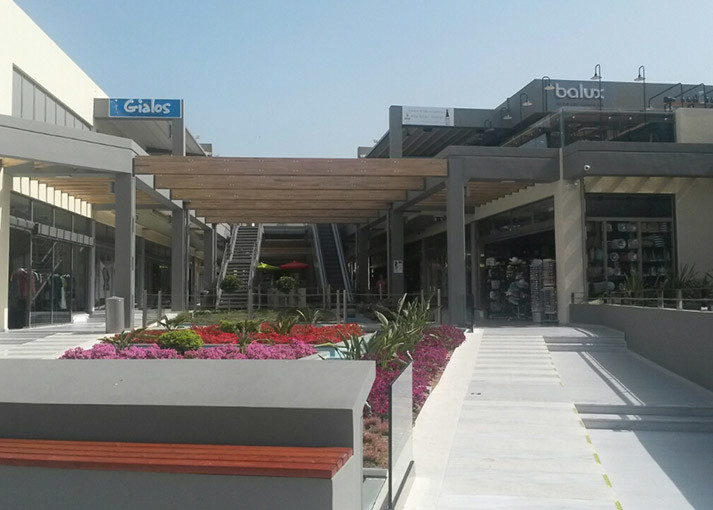
This screenshot has height=510, width=713. What are the coordinates of `wooden bench` in the screenshot? It's located at tap(302, 462).